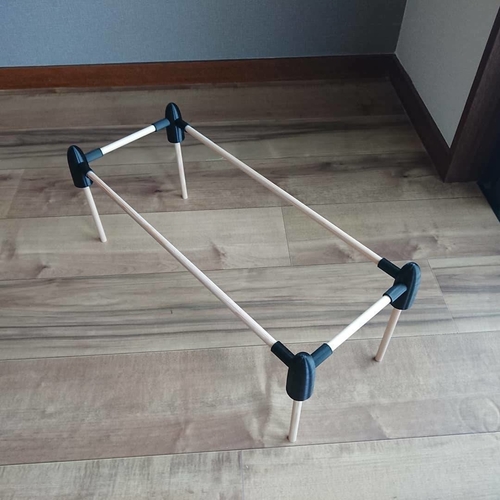
This screenshot has width=500, height=500. Identify the location of doorway. (485, 181).